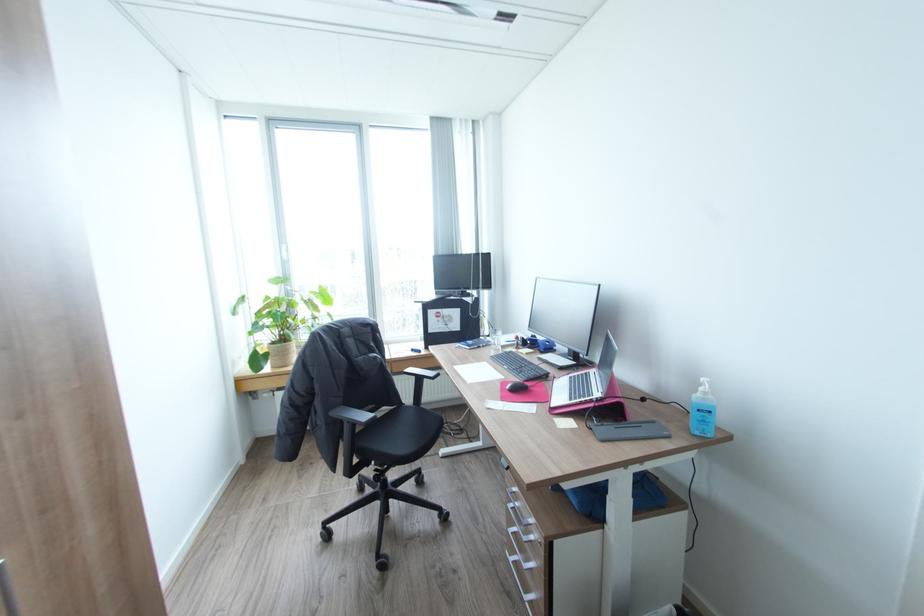
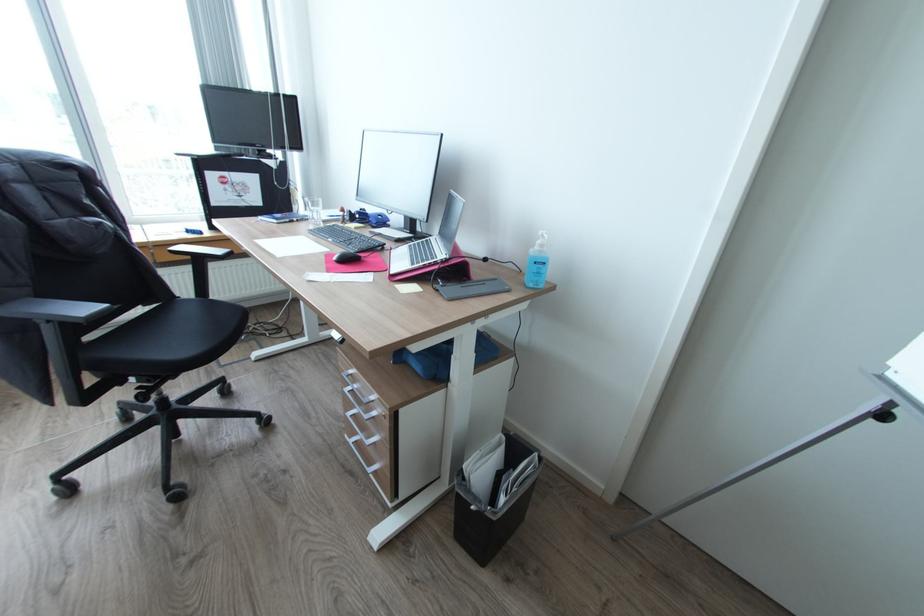
Locate, in the second image, the point that corresponds to (519,488) in the first image.

(357, 371)